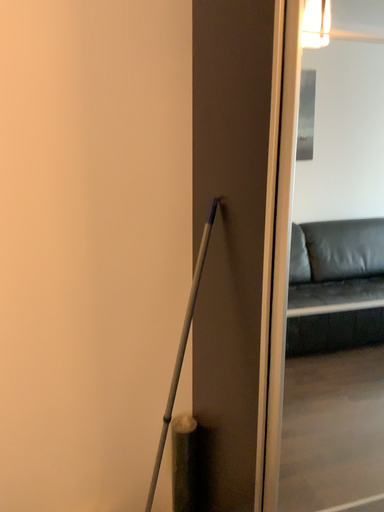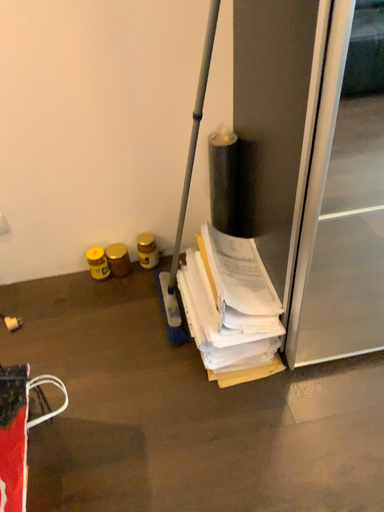
Question: How did the camera likely rotate when shooting the video?

Choices:
 (A) rotated upward
 (B) rotated downward

Answer: (B)